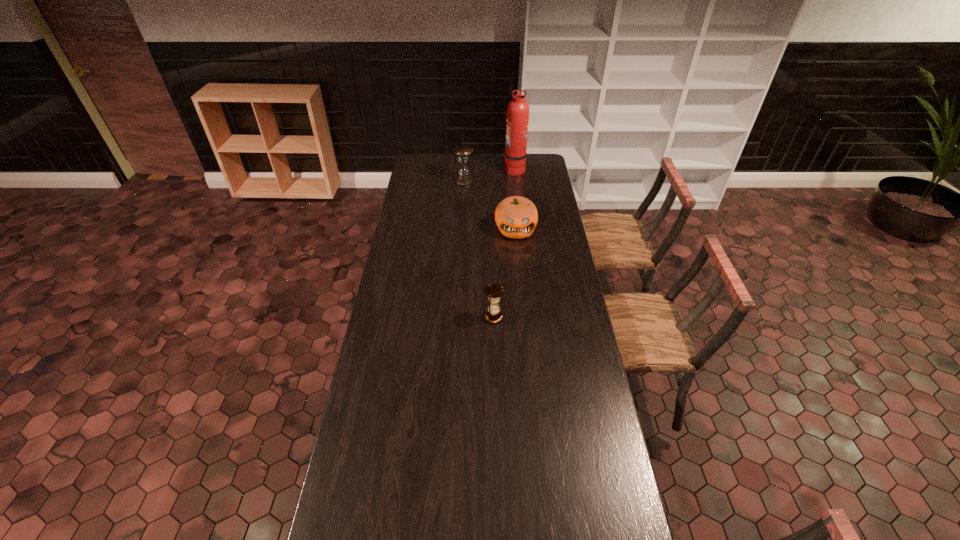
At what (x,y) coordinates should I click in order to perform the action: click on fire extinguisher. Please return your answer as a coordinate pair (x, y). Looking at the image, I should click on (517, 120).

The height and width of the screenshot is (540, 960). In order to click on the farther hourglass in this screenshot , I will do `click(463, 177)`.

This screenshot has height=540, width=960. In order to click on the leftmost object in this screenshot , I will do click(463, 177).

Locate an element on the screen. pumpkin is located at coordinates (516, 217).

This screenshot has width=960, height=540. What are the coordinates of `the nearest object` in the screenshot? It's located at (494, 291).

Find the location of a particular element. the shorter hourglass is located at coordinates (494, 291).

Find the location of a particular element. blank space located 0.070m on the label side of the fire extinguisher is located at coordinates (492, 168).

Locate an element on the screen. free location located on the label side of the fire extinguisher is located at coordinates (444, 168).

I want to click on free space located 0.360m on the label side of the fire extinguisher, so click(444, 168).

This screenshot has width=960, height=540. What are the coordinates of `free space located on the right of the farther hourglass` in the screenshot? It's located at coord(539,180).